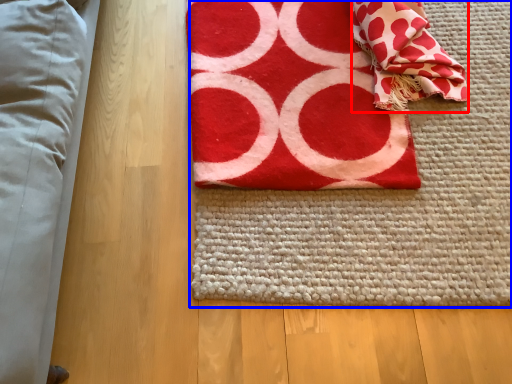
Question: Among these objects, which one is nearest to the camera, blanket (highlighted by a red box) or yoga mat (highlighted by a blue box)?

Choices:
 (A) blanket
 (B) yoga mat

Answer: (B)